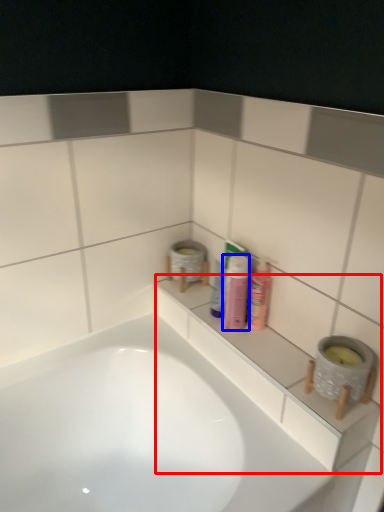
Question: Which object appears closest to the camera in this image, ledge (highlighted by a red box) or toiletry (highlighted by a blue box)?

Choices:
 (A) ledge
 (B) toiletry

Answer: (A)